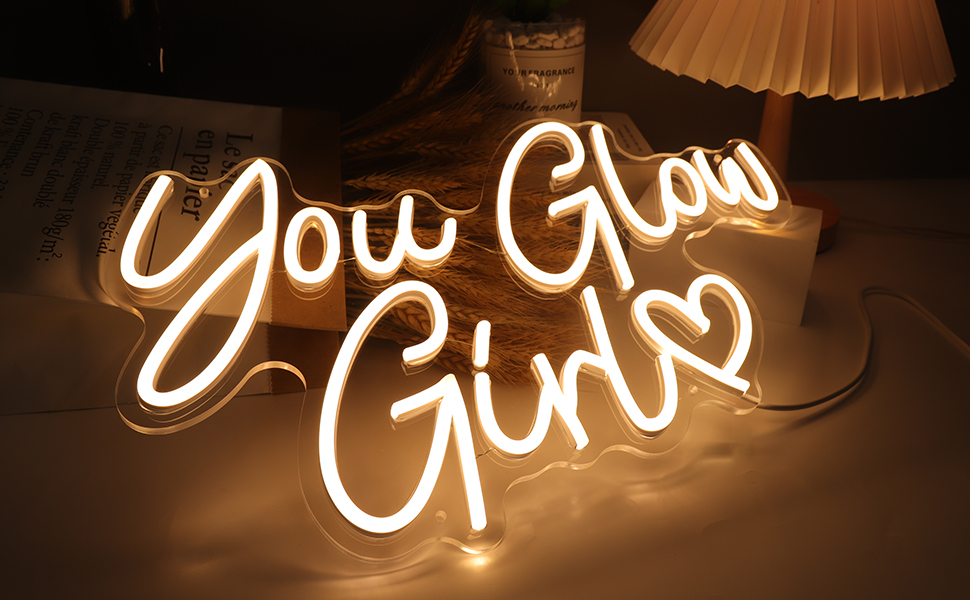
Where is `table`? table is located at coordinates (681, 531).